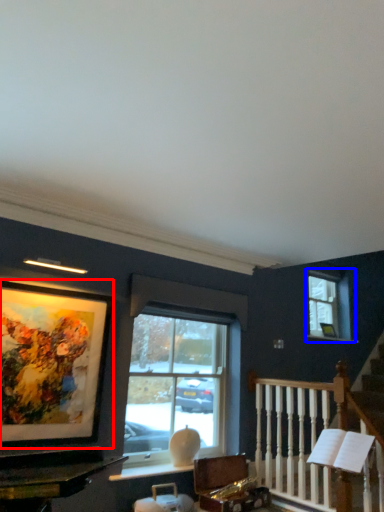
Question: Among these objects, which one is nearest to the camera, picture frame (highlighted by a red box) or window (highlighted by a blue box)?

Choices:
 (A) picture frame
 (B) window

Answer: (A)